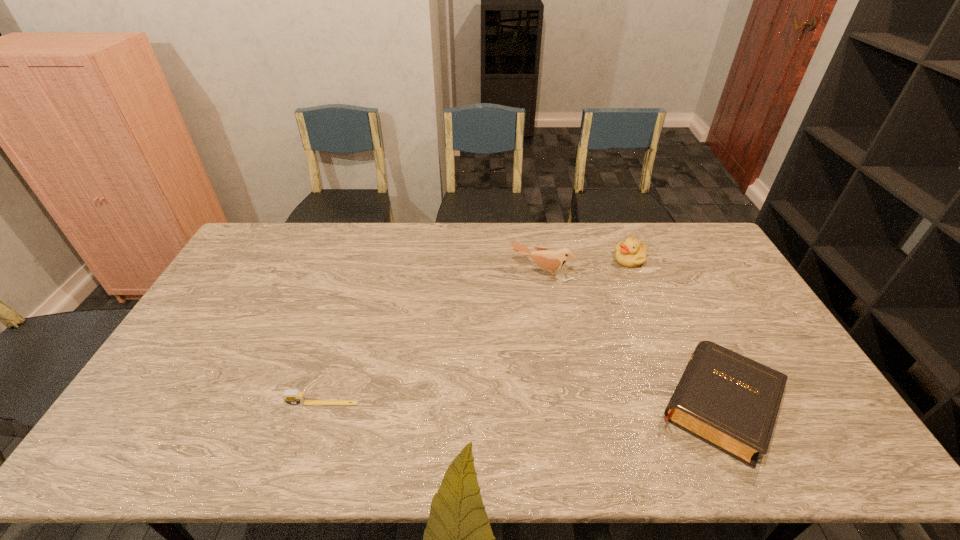
What are the coordinates of `blank area located 0.120m on the front-facing side of the duckling` in the screenshot? It's located at (609, 286).

Locate an element on the screen. The width and height of the screenshot is (960, 540). free space located 0.060m on the front-facing side of the duckling is located at coordinates (616, 277).

Identify the location of vacant space positioned on the front-facing side of the duckling. The height and width of the screenshot is (540, 960). (581, 321).

You are a GUI agent. You are given a task and a screenshot of the screen. Output one action in this format:
    pyautogui.click(x=<x>, y=<y>)
    Task: Click on the object present at the far edge
    This screenshot has height=540, width=960.
    Given the screenshot: What is the action you would take?
    pyautogui.click(x=631, y=253)

I want to click on tape measure positioned at the near edge, so click(293, 397).

This screenshot has height=540, width=960. Find the location of `Bible at the near edge`. Bible at the near edge is located at coordinates (731, 402).

Find the location of `object positioned at the right edge`. object positioned at the right edge is located at coordinates (731, 402).

Where is `object located in the near right corner section of the desktop`? The width and height of the screenshot is (960, 540). object located in the near right corner section of the desktop is located at coordinates (731, 402).

Identify the location of free space at the far edge of the desktop. (313, 254).

Locate an element on the screen. Image resolution: width=960 pixels, height=540 pixels. vacant space at the left edge of the desktop is located at coordinates (217, 344).